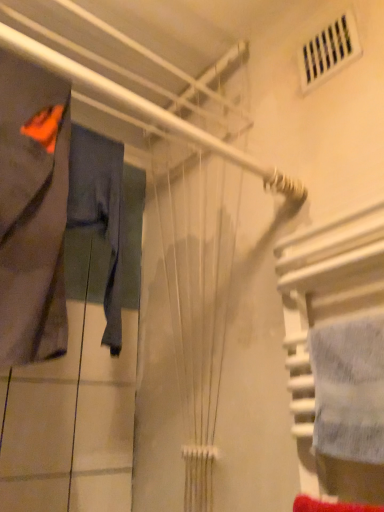
Question: In the image, is denim pants at left, placed as the first clothing when sorted from back to front, positioned in front of or behind white textured towel at right?

Choices:
 (A) behind
 (B) front

Answer: (A)

Question: From the image's perspective, is denim pants at left, which is the 2th clothing from front to back, above or below white textured towel at right?

Choices:
 (A) above
 (B) below

Answer: (A)

Question: Which object is the closest to the matte gray fabric at left, positioned as the 1th clothing in front-to-back order?

Choices:
 (A) white textured towel at right
 (B) denim pants at left, which is the 2th clothing from front to back

Answer: (B)

Question: Estimate the real-world distances between objects in this image. Which object is farther from the denim pants at left, which is the 2th clothing from front to back?

Choices:
 (A) matte gray fabric at left, positioned as the 1th clothing in front-to-back order
 (B) white textured towel at right

Answer: (B)